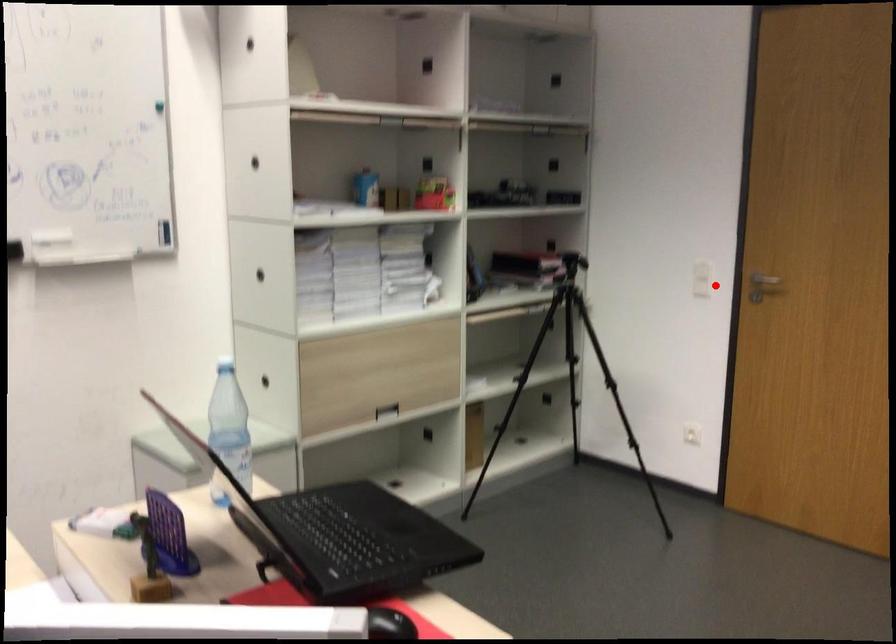
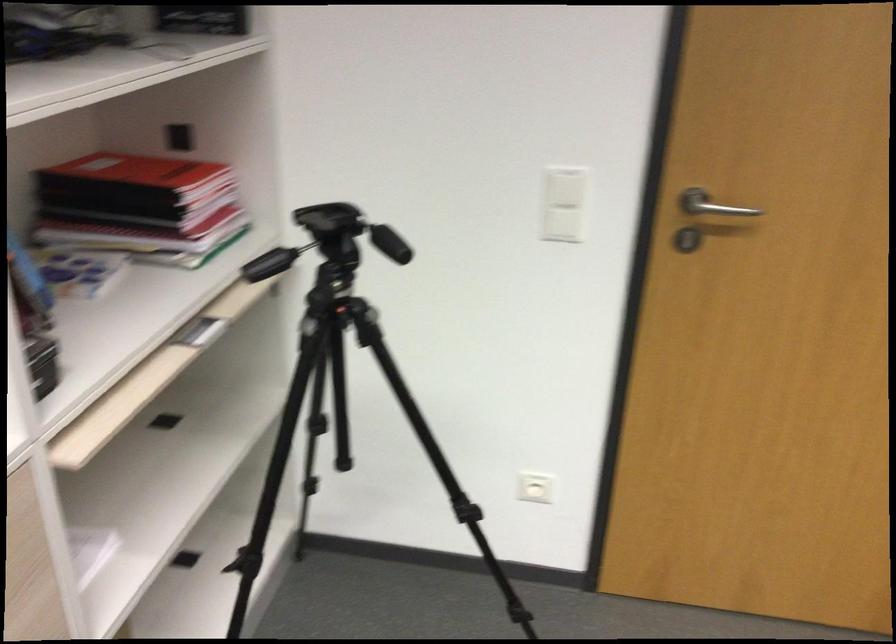
The point at the highlighted location is marked in the first image. Where is the corresponding point in the second image?

(563, 225)